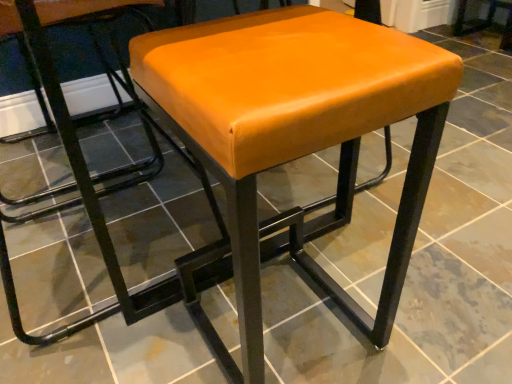
The image size is (512, 384). In order to click on vacant space behind orange leather stool at center in this screenshot , I will do `click(282, 250)`.